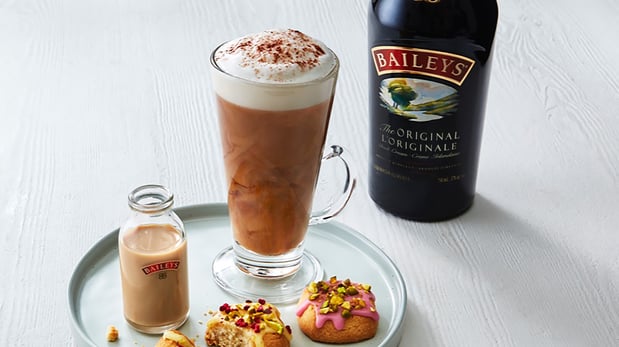
Image resolution: width=619 pixels, height=347 pixels. Find the location of `glass`. glass is located at coordinates (158, 233).